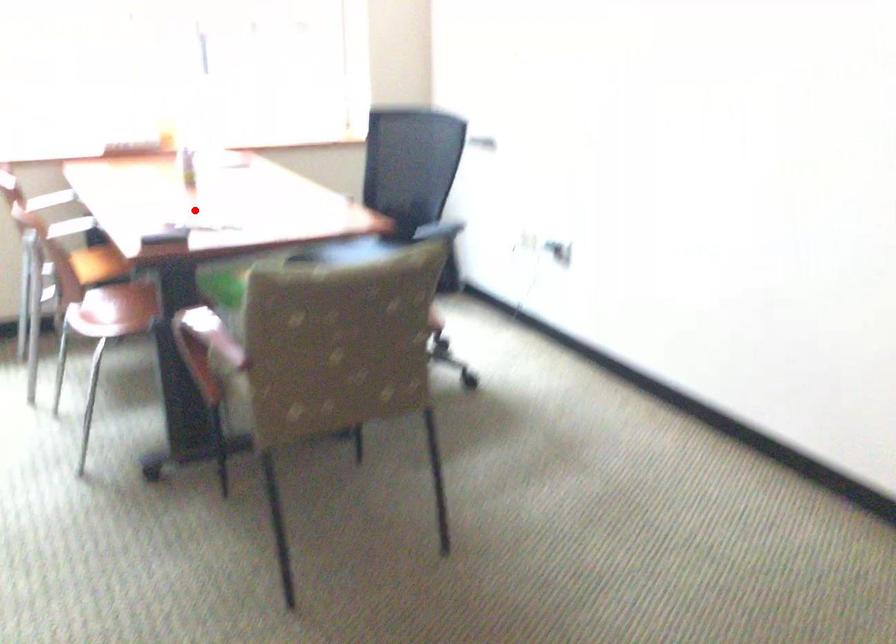
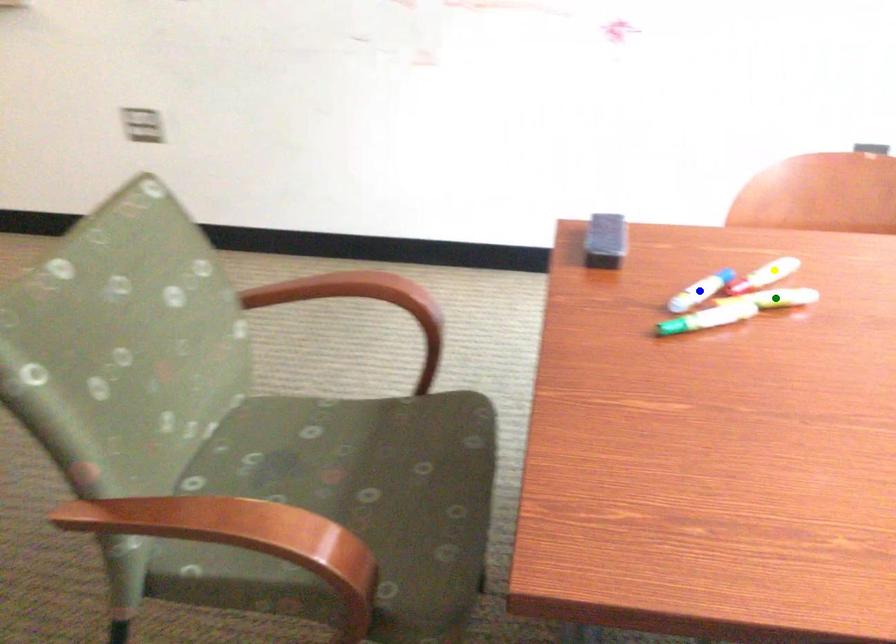
Question: I am providing you with two images of the same scene from different viewpoints. A red point is marked on the first image. You are given multiple points on the second image. Can you choose the point in image 2 that corresponds to the point in image 1?

Choices:
 (A) blue point
 (B) green point
 (C) yellow point

Answer: (B)